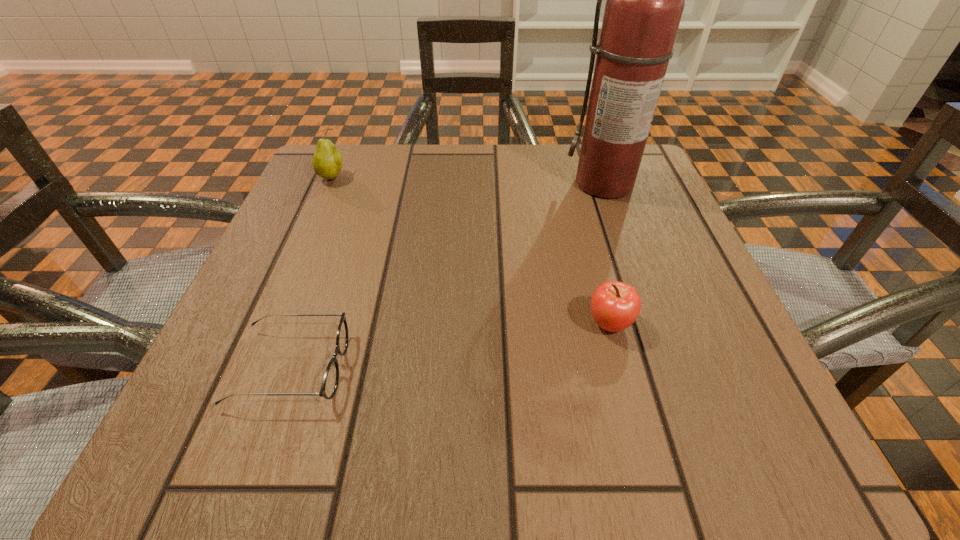
You are a GUI agent. You are given a task and a screenshot of the screen. Output one action in this format:
    pyautogui.click(x=<x>, y=<y>)
    Task: Click on the vacant space at the left edge of the desktop
    The width and height of the screenshot is (960, 540).
    Given the screenshot: What is the action you would take?
    [302, 234]

At what (x,y) coordinates should I click in order to perform the action: click on vacant space at the far left corner of the desktop. Please return your answer as a coordinate pair (x, y). This screenshot has height=540, width=960. Looking at the image, I should click on (313, 201).

Locate an element on the screen. Image resolution: width=960 pixels, height=540 pixels. free space at the far right corner is located at coordinates click(x=652, y=177).

This screenshot has width=960, height=540. I want to click on free location at the near right corner, so click(654, 404).

Locate an element on the screen. Image resolution: width=960 pixels, height=540 pixels. blank region between the third tallest object and the shortest object is located at coordinates (x=450, y=346).

At what (x,y) coordinates should I click in order to perform the action: click on vacant area that lies between the spectacles and the pear. Please return your answer as a coordinate pair (x, y). Image resolution: width=960 pixels, height=540 pixels. Looking at the image, I should click on (312, 273).

Where is `empty space between the shortest object and the fire extinguisher`? empty space between the shortest object and the fire extinguisher is located at coordinates (x=448, y=275).

Image resolution: width=960 pixels, height=540 pixels. What are the coordinates of `free space that is in between the fire extinguisher and the apple` in the screenshot? It's located at (608, 254).

Locate an element on the screen. free point between the fire extinguisher and the pear is located at coordinates (469, 180).

Identify the location of free spot between the second tallest object and the fire extinguisher. (469, 180).